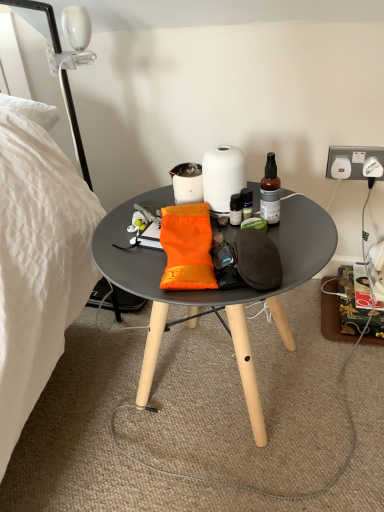
Question: Are matte white coffee cup at center and orange fabric pouch at center making contact?

Choices:
 (A) yes
 (B) no

Answer: (B)

Question: Is matte white coffee cup at center thinner than orange fabric pouch at center?

Choices:
 (A) yes
 (B) no

Answer: (A)

Question: From a real-world perspective, is matte white coffee cup at center located beneath orange fabric pouch at center?

Choices:
 (A) yes
 (B) no

Answer: (B)

Question: From a real-world perspective, is matte white coffee cup at center located higher than orange fabric pouch at center?

Choices:
 (A) yes
 (B) no

Answer: (A)

Question: Is matte white coffee cup at center to the left of orange fabric pouch at center from the viewer's perspective?

Choices:
 (A) no
 (B) yes

Answer: (A)

Question: Is point (173, 181) positioned closer to the camera than point (67, 83)?

Choices:
 (A) farther
 (B) closer

Answer: (A)

Question: From the image's perspective, is matte white coffee cup at center positioned above or below white glossy lamp at upper left?

Choices:
 (A) below
 (B) above

Answer: (A)

Question: Do you think matte white coffee cup at center is within white glossy lamp at upper left, or outside of it?

Choices:
 (A) inside
 (B) outside

Answer: (B)

Question: From a real-world perspective, is matte white coffee cup at center above or below white glossy lamp at upper left?

Choices:
 (A) above
 (B) below

Answer: (B)

Question: In the image, is white glossy lamp at upper left positioned in front of or behind matte black table at center?

Choices:
 (A) behind
 (B) front

Answer: (A)

Question: Is white glossy lamp at upper left wider or thinner than matte black table at center?

Choices:
 (A) wide
 (B) thin

Answer: (B)

Question: Is white glossy lamp at upper left inside the boundaries of matte black table at center, or outside?

Choices:
 (A) outside
 (B) inside

Answer: (A)

Question: In terms of height, does white glossy lamp at upper left look taller or shorter compared to matte black table at center?

Choices:
 (A) short
 (B) tall

Answer: (A)

Question: Is point (347, 166) positioned closer to the camera than point (269, 187)?

Choices:
 (A) closer
 (B) farther

Answer: (B)

Question: From the image's perspective, is white plastic power outlet at upper right above or below translucent glass bottle at upper right?

Choices:
 (A) below
 (B) above

Answer: (B)